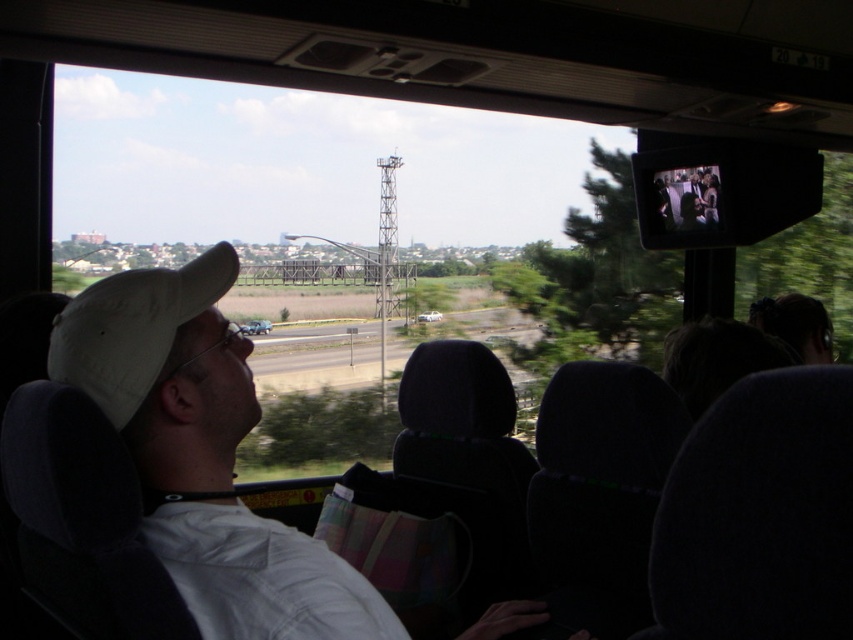
Is white matte cap at upper left positioned behind white matte baseball hat at left?

No, it is not.

Is point (357, 618) positioned after point (59, 358)?

That is False.

Locate an element on the screen. Image resolution: width=853 pixels, height=640 pixels. white matte cap at upper left is located at coordinates (204, 454).